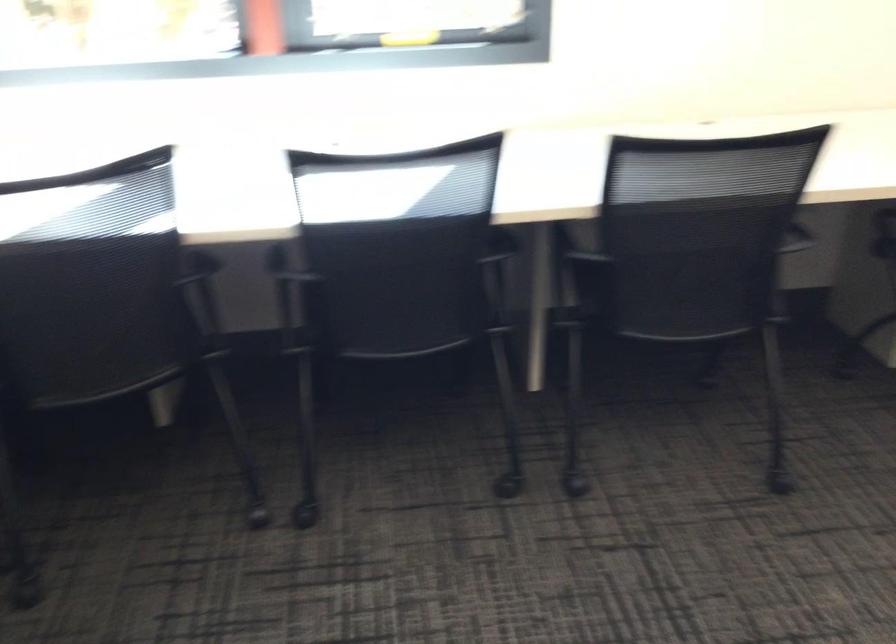
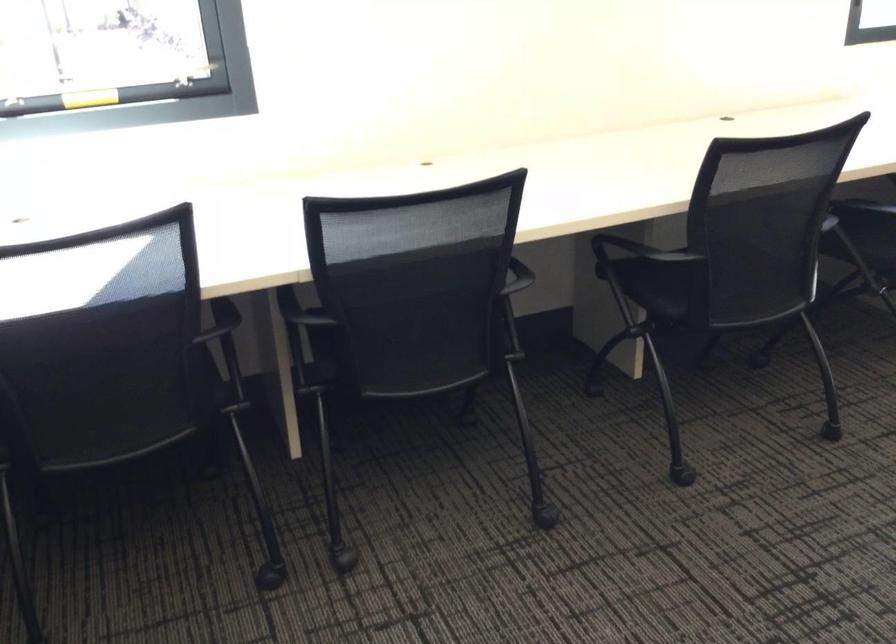
Question: The camera is either moving clockwise (left) or counter-clockwise (right) around the object. The first image is from the beginning of the video and the second image is from the end. Is the camera moving left or right when shooting the video?

Choices:
 (A) Left
 (B) Right

Answer: (A)